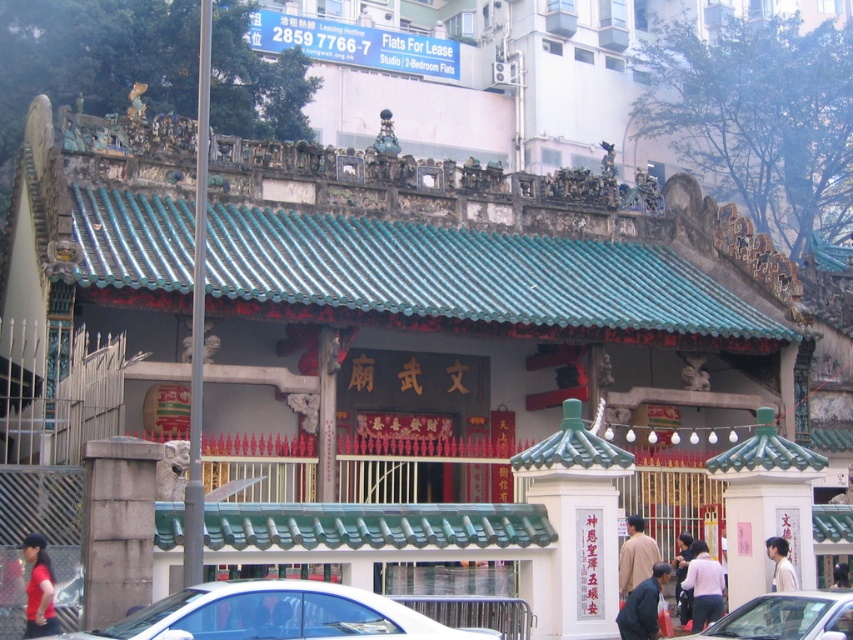
Question: Is light pink fabric at center thinner than dark hair at center?

Choices:
 (A) yes
 (B) no

Answer: (A)

Question: Which point is farther from the camera taking this photo?

Choices:
 (A) (634, 577)
 (B) (277, 300)

Answer: (B)

Question: Does metallic silver car at lower center come behind light brown hair at center?

Choices:
 (A) no
 (B) yes

Answer: (A)

Question: Is matte red shirt at lower left wider than brown matte shirt at center?

Choices:
 (A) no
 (B) yes

Answer: (A)

Question: Among these points, which one is farthest from the camera?

Choices:
 (A) (683, 614)
 (B) (28, 586)

Answer: (A)

Question: Which point appears farthest from the camera in this image?

Choices:
 (A) (106, 632)
 (B) (773, 548)
 (C) (843, 564)

Answer: (C)